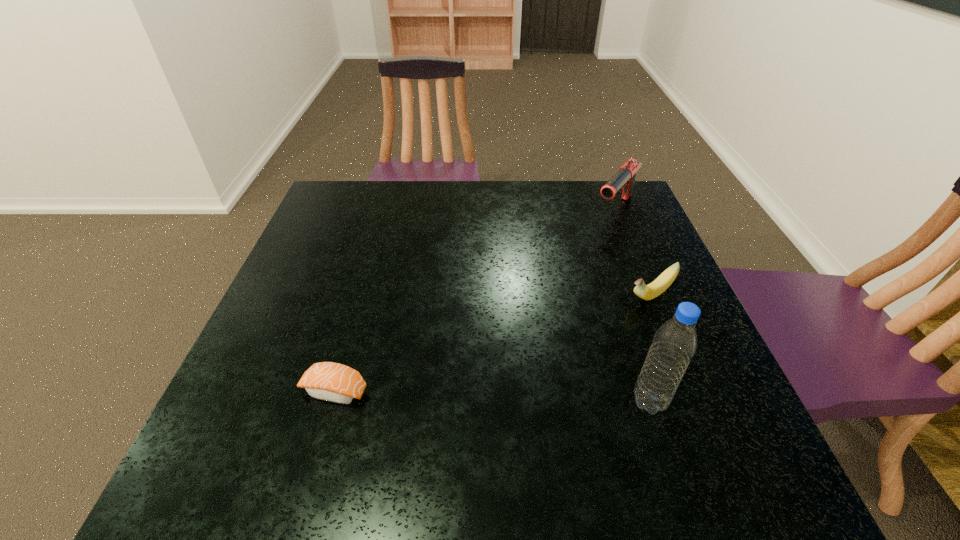
In order to click on banana at the right edge in this screenshot , I will do `click(647, 292)`.

Identify the location of gun located at the right edge. This screenshot has width=960, height=540. (624, 179).

Identify the location of object that is at the near left corner. The width and height of the screenshot is (960, 540). pyautogui.click(x=329, y=381).

At what (x,y) coordinates should I click in order to perform the action: click on object at the far right corner. Please return your answer as a coordinate pair (x, y). The image size is (960, 540). Looking at the image, I should click on (624, 179).

The image size is (960, 540). I want to click on object that is at the near right corner, so click(675, 342).

Where is `vacant space at the far edge`? Image resolution: width=960 pixels, height=540 pixels. vacant space at the far edge is located at coordinates (477, 181).

The width and height of the screenshot is (960, 540). In the image, there is a desktop. In order to click on vacant space at the near edge in this screenshot , I will do `click(318, 409)`.

Find the location of `vacant space at the left edge`. vacant space at the left edge is located at coordinates (332, 241).

Image resolution: width=960 pixels, height=540 pixels. I want to click on vacant space at the right edge of the desktop, so click(709, 373).

In the image, there is a desktop. Where is `blank space at the far left corner`? blank space at the far left corner is located at coordinates (354, 218).